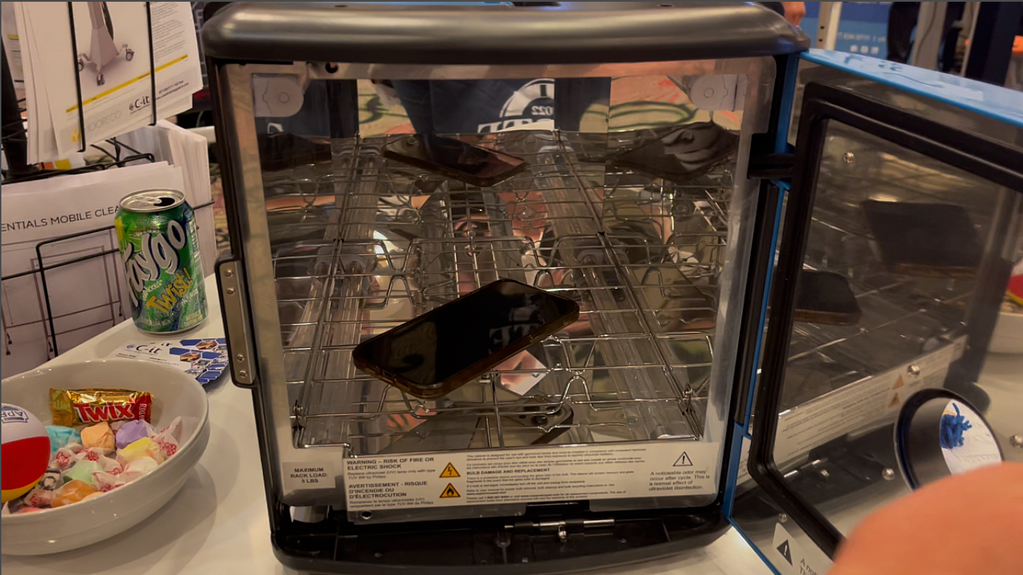
Locate an element on the screen. racks is located at coordinates click(x=583, y=246), click(x=599, y=301), click(x=623, y=397).